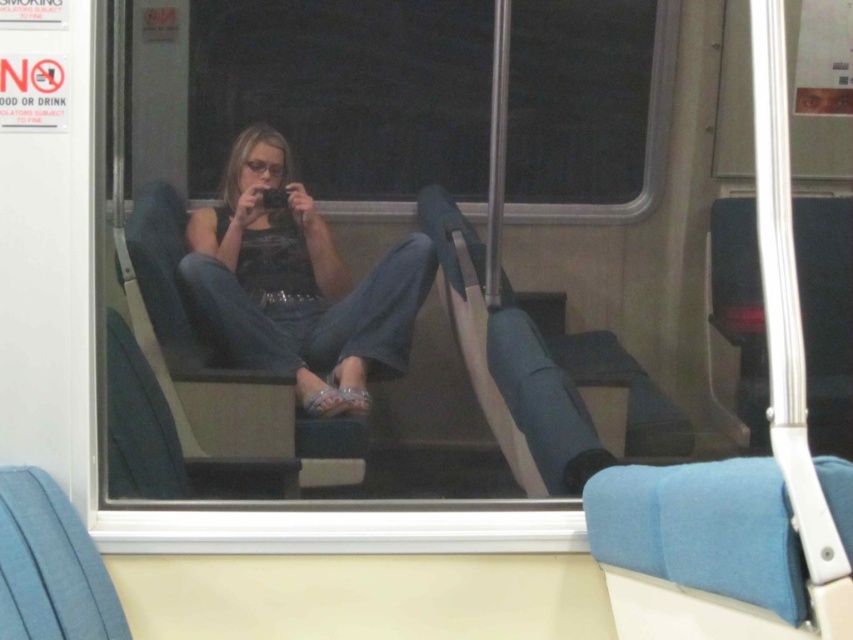
You are a passenger on a train and you want to know if you can see the outside scenery through the transparent glass window at center while sitting on the denim jeans at center. Can you see the scenery?

The denim jeans at center is taller than transparent glass window at center, so the jeans would block your view of the scenery through the transparent glass window at center.